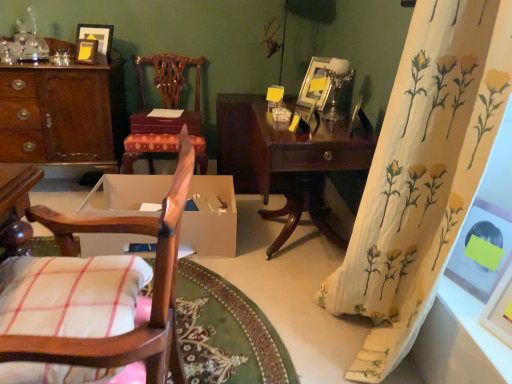
Question: Is wooden desk at left outside matte white picture frame at right, which is the fifth picture frame in top-to-bottom order?

Choices:
 (A) yes
 (B) no

Answer: (A)

Question: From a real-world perspective, is wooden desk at left physically above matte white picture frame at right, positioned as the fifth picture frame in left-to-right order?

Choices:
 (A) no
 (B) yes

Answer: (A)

Question: From the image's perspective, is wooden desk at left over matte white picture frame at right, placed as the 5th picture frame when sorted from back to front?

Choices:
 (A) yes
 (B) no

Answer: (A)

Question: Can you confirm if wooden desk at left is thinner than matte white picture frame at right, which is the fifth picture frame in top-to-bottom order?

Choices:
 (A) yes
 (B) no

Answer: (B)

Question: Does wooden desk at left have a smaller size compared to matte white picture frame at right, the first picture frame when ordered from right to left?

Choices:
 (A) yes
 (B) no

Answer: (B)

Question: From a real-world perspective, is white cotton pillow at lower left above or below white floral fabric curtain at right?

Choices:
 (A) above
 (B) below

Answer: (B)

Question: Based on their positions, is white cotton pillow at lower left located to the left or right of white floral fabric curtain at right?

Choices:
 (A) left
 (B) right

Answer: (A)

Question: Considering the positions of white cotton pillow at lower left and white floral fabric curtain at right in the image, is white cotton pillow at lower left wider or thinner than white floral fabric curtain at right?

Choices:
 (A) thin
 (B) wide

Answer: (B)

Question: Is point (80, 316) closer or farther from the camera than point (392, 170)?

Choices:
 (A) farther
 (B) closer

Answer: (B)

Question: From the image's perspective, is white cotton pillow at lower left positioned above or below wooden chair with checkered cushion at left, which is the second chair in back-to-front order?

Choices:
 (A) below
 (B) above

Answer: (B)

Question: In the image, is white cotton pillow at lower left on the left side or the right side of wooden chair with checkered cushion at left, which is the second chair in back-to-front order?

Choices:
 (A) right
 (B) left

Answer: (B)

Question: Is point (104, 294) closer or farther from the camera than point (188, 183)?

Choices:
 (A) closer
 (B) farther

Answer: (B)

Question: In the image, is white cotton pillow at lower left positioned in front of or behind wooden chair with checkered cushion at left, the 1th chair from the front?

Choices:
 (A) behind
 (B) front

Answer: (A)

Question: Considering the positions of point (53, 286) and point (120, 66), is point (53, 286) closer or farther from the camera than point (120, 66)?

Choices:
 (A) closer
 (B) farther

Answer: (A)

Question: From their relative heights in the image, would you say white cotton pillow at lower left is taller or shorter than wooden desk at left?

Choices:
 (A) tall
 (B) short

Answer: (B)